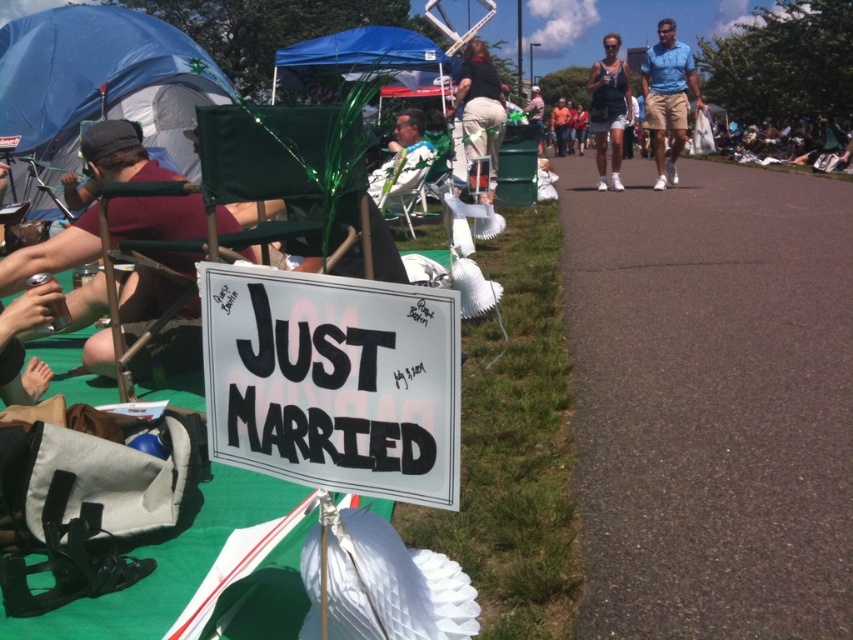
Question: Estimate the real-world distances between objects in this image. Which object is closer to the blue fabric canopy at upper center?

Choices:
 (A) white cotton shirt at center
 (B) blue fabric canopy at upper left
 (C) maroon fabric shirt at left

Answer: (B)

Question: Can you confirm if maroon fabric shirt at left is wider than blue cotton shirt at upper right?

Choices:
 (A) yes
 (B) no

Answer: (A)

Question: Among these objects, which one is farthest from the camera?

Choices:
 (A) blue fabric canopy at upper center
 (B) maroon fabric shirt at left
 (C) white paper sign at center

Answer: (A)

Question: Can you confirm if maroon fabric shirt at left is thinner than denim shorts at center?

Choices:
 (A) no
 (B) yes

Answer: (A)

Question: Which point appears farthest from the camera in this image?

Choices:
 (A) (577, 124)
 (B) (494, 164)

Answer: (A)

Question: Does blue fabric canopy at upper center have a larger size compared to blue cotton shirt at upper right?

Choices:
 (A) yes
 (B) no

Answer: (A)